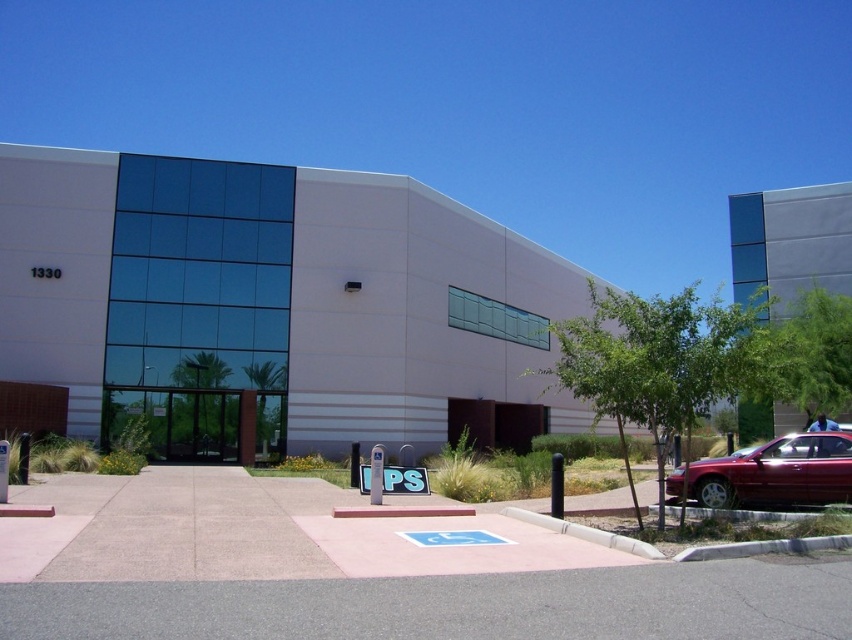
How far apart are gray asphalt pavement at lower center and glossy metallic sedan at lower right?

gray asphalt pavement at lower center is 26.36 feet away from glossy metallic sedan at lower right.

Measure the distance between point (x=363, y=630) and camera.

Point (x=363, y=630) is 5.49 meters away from camera.

Is point (758, 586) closer to viewer compared to point (835, 476)?

Yes, it is in front of point (835, 476).

I want to click on gray asphalt pavement at lower center, so click(456, 605).

Is gray asphalt pavement at lower center taller than white plastic parking sign at center?

In fact, gray asphalt pavement at lower center may be shorter than white plastic parking sign at center.

Is point (243, 580) farther from camera compared to point (367, 483)?

No.

Between point (464, 618) and point (412, 481), which one is positioned in front?

Point (464, 618) is in front.

This screenshot has width=852, height=640. I want to click on gray asphalt pavement at lower center, so click(x=456, y=605).

Is point (841, 467) positioned after point (369, 483)?

No.

Which is in front, point (781, 445) or point (367, 468)?

Point (781, 445)

You are a GUI agent. You are given a task and a screenshot of the screen. Output one action in this format:
    pyautogui.click(x=<x>, y=<y>)
    Task: Click on the glossy metallic sedan at lower right
    
    Given the screenshot: What is the action you would take?
    (x=772, y=474)